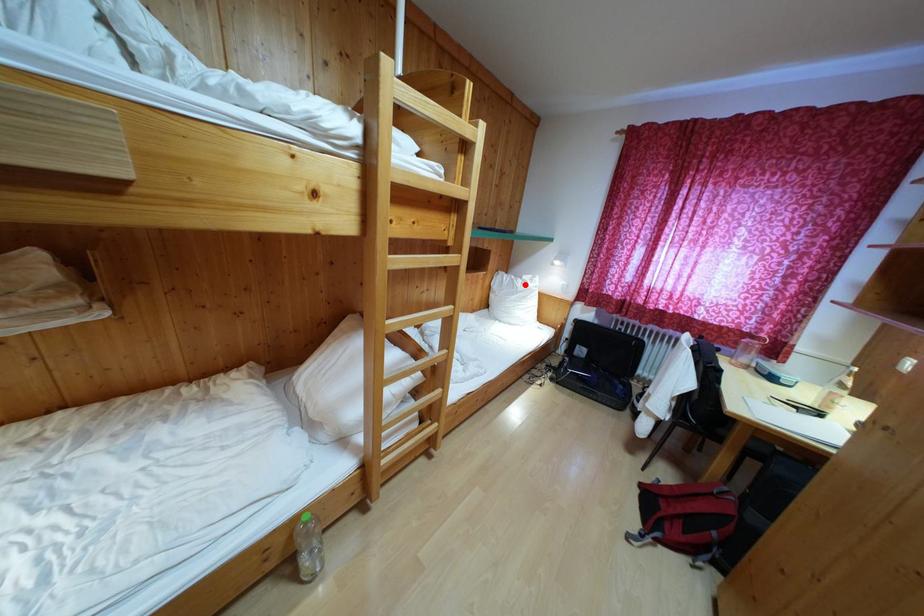
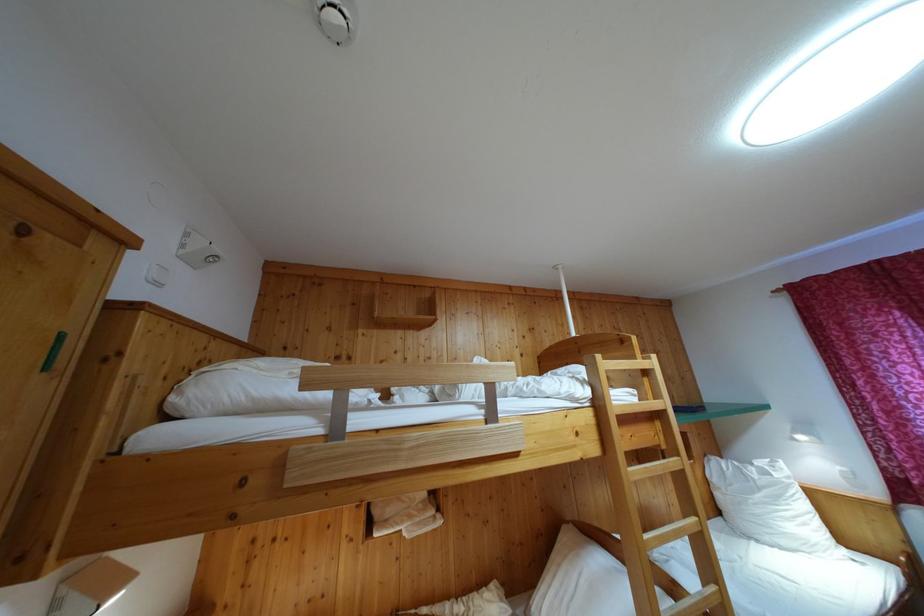
In the second image, find the point that corresponds to the highlighted location in the first image.

(755, 471)